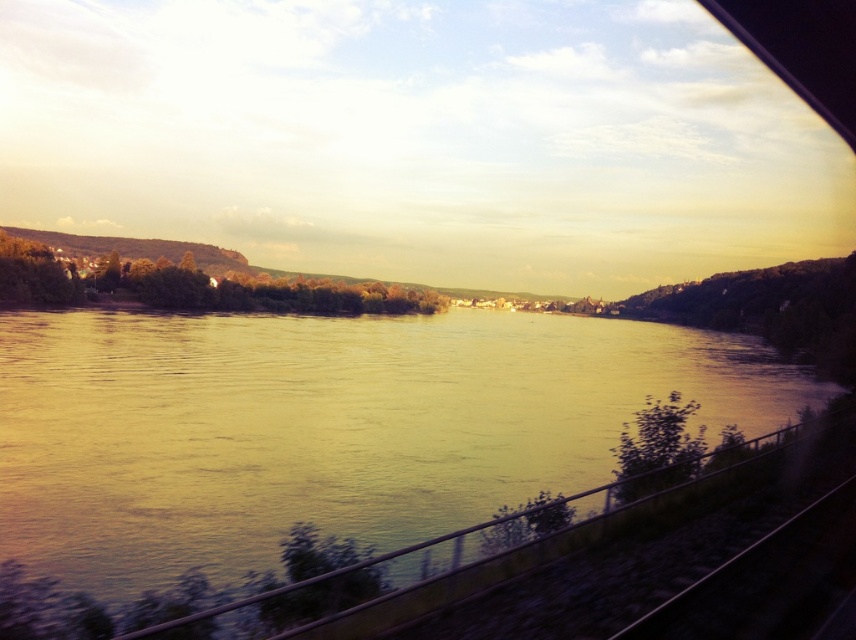
Is yellowish water at center behind black metal train track at lower right?

Yes, it is behind black metal train track at lower right.

Is yellowish water at center above black metal train track at lower right?

Correct, yellowish water at center is located above black metal train track at lower right.

Who is more forward, [193,481] or [714,566]?

Point [714,566] is in front.

Where is `yellowish water at center`? yellowish water at center is located at coordinates (325, 426).